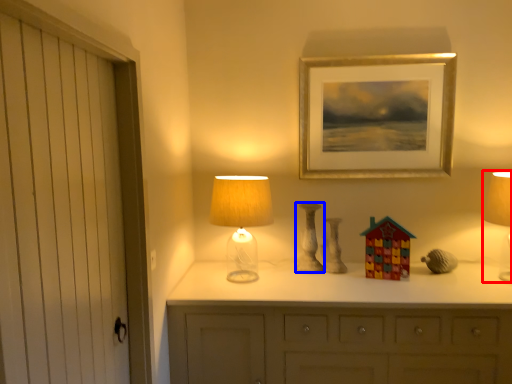
Question: Which object appears farthest to the camera in this image, table lamp (highlighted by a red box) or candle holder (highlighted by a blue box)?

Choices:
 (A) table lamp
 (B) candle holder

Answer: (B)